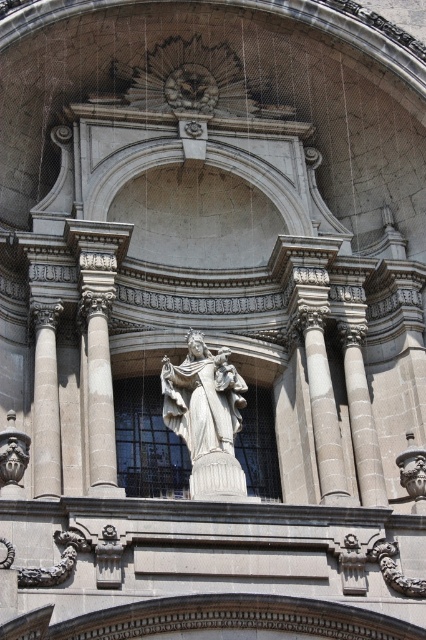
Does white marble statue at center appear on the right side of white marble column at left?

Correct, you'll find white marble statue at center to the right of white marble column at left.

Which is below, white marble statue at center or white marble column at left?

Positioned lower is white marble statue at center.

You are a GUI agent. You are given a task and a screenshot of the screen. Output one action in this format:
    pyautogui.click(x=<x>, y=<y>)
    Task: Click on the white marble statue at center
    
    Given the screenshot: What is the action you would take?
    pyautogui.click(x=206, y=417)

Who is more forward, (215, 493) or (89, 289)?

Point (215, 493) is more forward.

How distant is white marble statue at center from gray stone column at center?

The distance of white marble statue at center from gray stone column at center is 4.38 meters.

The image size is (426, 640). Describe the element at coordinates (206, 417) in the screenshot. I see `white marble statue at center` at that location.

Identify the location of white marble statue at center. (206, 417).

Which is below, gray stone column at center or white marble column at left?

white marble column at left is lower down.

Who is positioned more to the left, gray stone column at center or white marble column at left?

From the viewer's perspective, white marble column at left appears more on the left side.

Where is `gray stone column at center`? This screenshot has height=640, width=426. gray stone column at center is located at coordinates (98, 339).